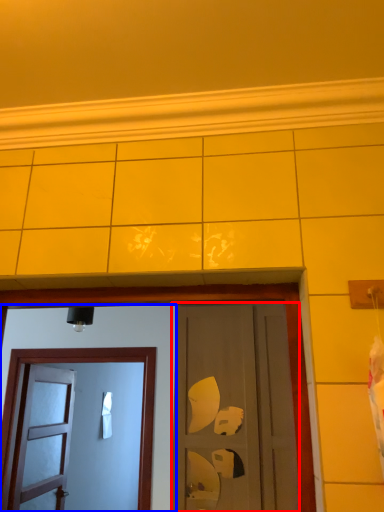
Question: Among these objects, which one is farthest to the camera, door (highlighted by a red box) or door (highlighted by a blue box)?

Choices:
 (A) door
 (B) door

Answer: (B)